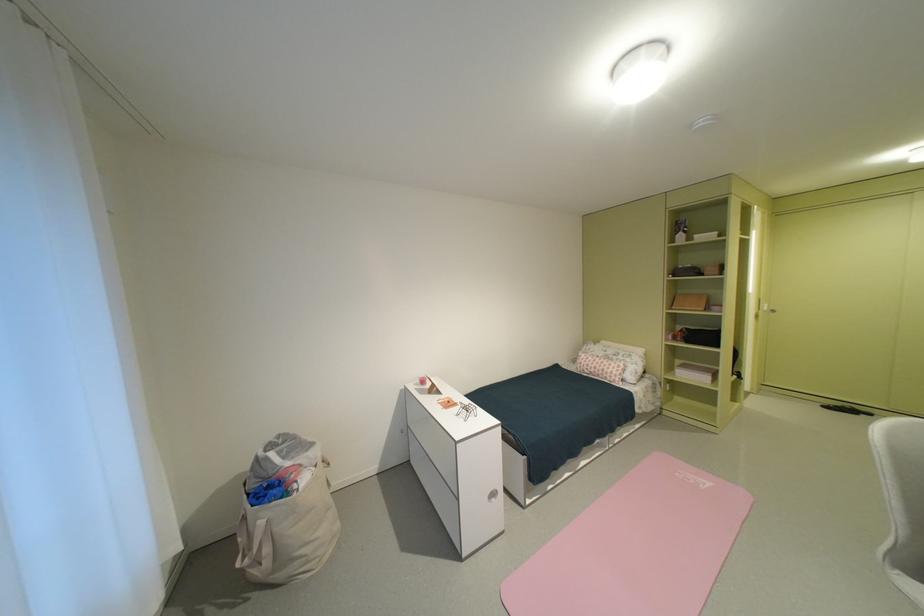
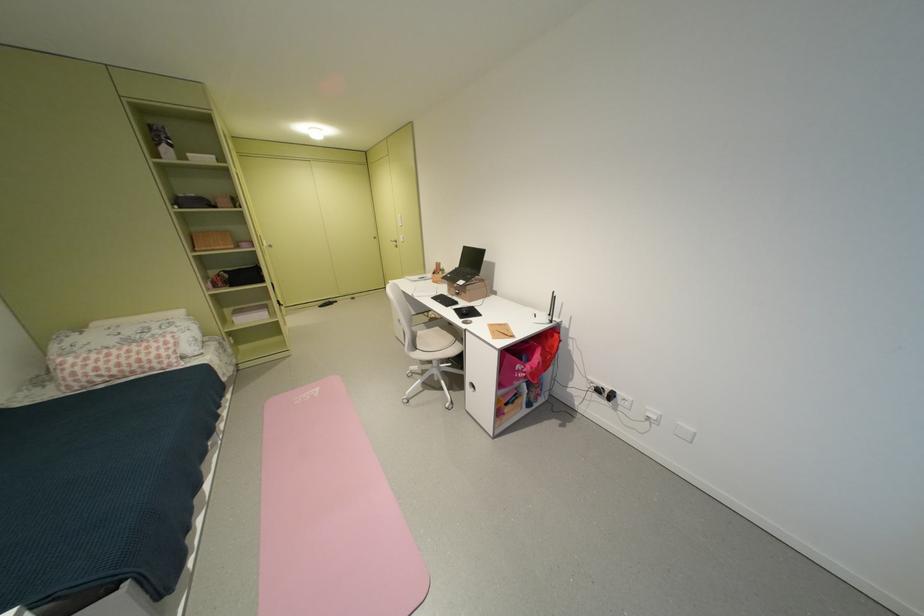
The point at (616, 374) is marked in the first image. Where is the corresponding point in the second image?

(159, 362)